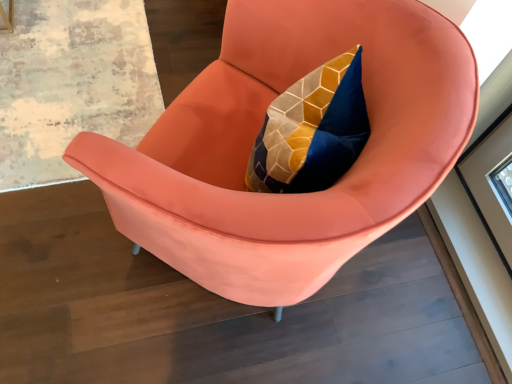
Image resolution: width=512 pixels, height=384 pixels. I want to click on velvet orange chair at center, so click(258, 130).

The width and height of the screenshot is (512, 384). Describe the element at coordinates (258, 130) in the screenshot. I see `velvet orange chair at center` at that location.

What are the coordinates of `velvet orange chair at center` in the screenshot? It's located at (258, 130).